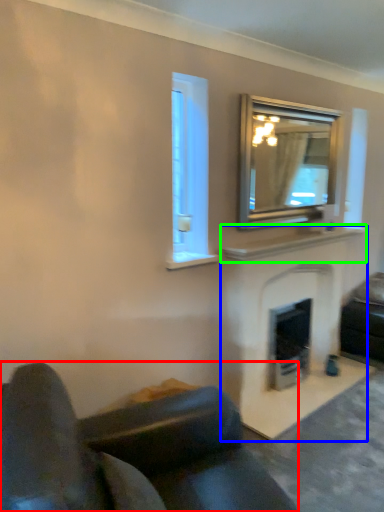
Question: Which object is the farthest from studio couch (highlighted by a red box)? Choose among these: fireplace (highlighted by a blue box) or mantle (highlighted by a green box).

Choices:
 (A) fireplace
 (B) mantle

Answer: (B)